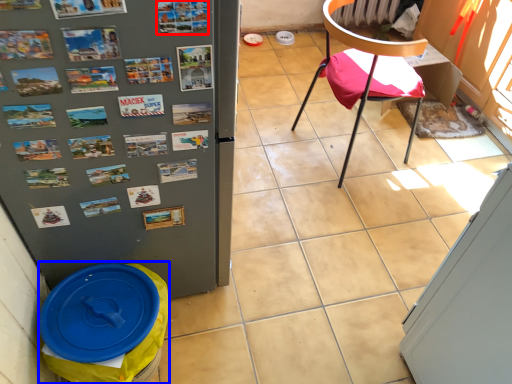
Question: Which object appears closest to the camera in this image, poster (highlighted by a red box) or garbage (highlighted by a blue box)?

Choices:
 (A) poster
 (B) garbage

Answer: (A)